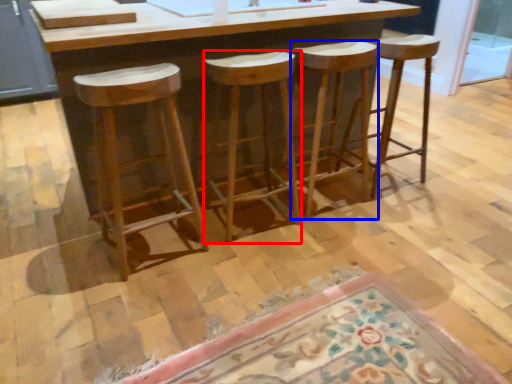
Question: Which object appears farthest to the camera in this image, stool (highlighted by a red box) or stool (highlighted by a blue box)?

Choices:
 (A) stool
 (B) stool

Answer: (B)